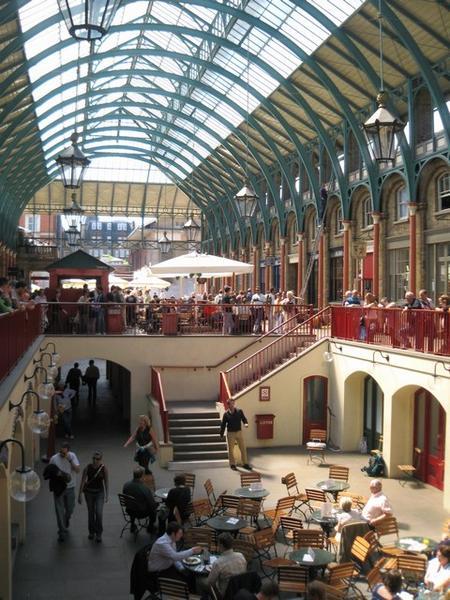
This screenshot has width=450, height=600. I want to click on doors, so click(x=430, y=468), click(x=309, y=426), click(x=372, y=436).